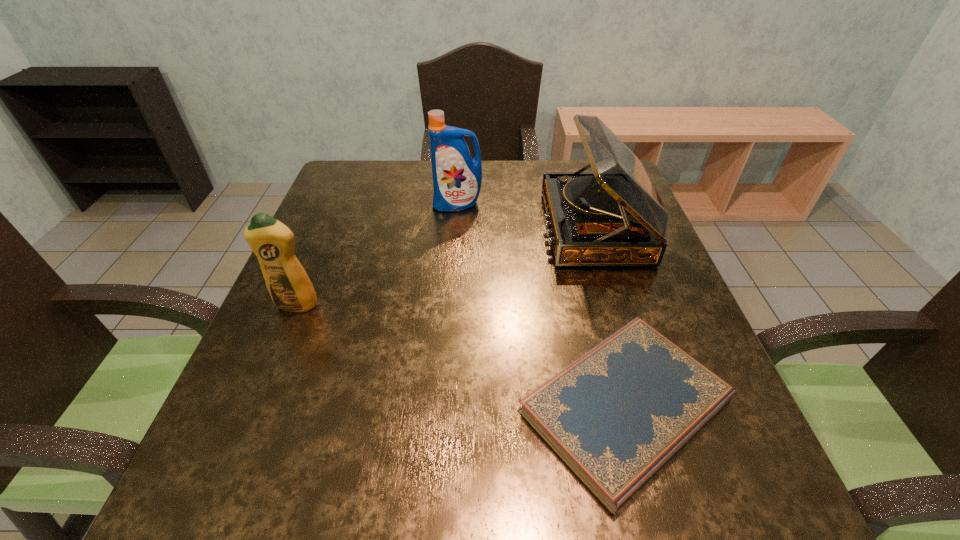
The height and width of the screenshot is (540, 960). In order to click on object that is positioned at the near right corner in this screenshot , I will do pyautogui.click(x=615, y=416).

This screenshot has width=960, height=540. I want to click on vacant region at the far edge, so (565, 168).

In order to click on vacant space at the near edge in this screenshot , I will do `click(321, 483)`.

This screenshot has height=540, width=960. In order to click on free location at the left edge of the desktop in this screenshot , I will do `click(241, 385)`.

The height and width of the screenshot is (540, 960). What are the coordinates of `free location at the right edge` in the screenshot? It's located at (708, 462).

The width and height of the screenshot is (960, 540). In the image, there is a desktop. Find the location of `free region at the far left corner`. free region at the far left corner is located at coordinates (378, 195).

In the image, there is a desktop. Where is `vacant area at the far right corner`? The width and height of the screenshot is (960, 540). vacant area at the far right corner is located at coordinates (569, 162).

The width and height of the screenshot is (960, 540). I want to click on vacant space that's between the nearer detergent and the third object from right to left, so [x=377, y=255].

You are a GUI agent. You are given a task and a screenshot of the screen. Output one action in this format:
    pyautogui.click(x=<x>, y=<y>)
    Task: Click on the free space between the second nearest object and the farther detergent
    Image resolution: width=960 pixels, height=540 pixels.
    Given the screenshot: What is the action you would take?
    pyautogui.click(x=377, y=255)

This screenshot has width=960, height=540. In order to click on empty space that is in between the right detergent and the record player in this screenshot , I will do `click(526, 216)`.